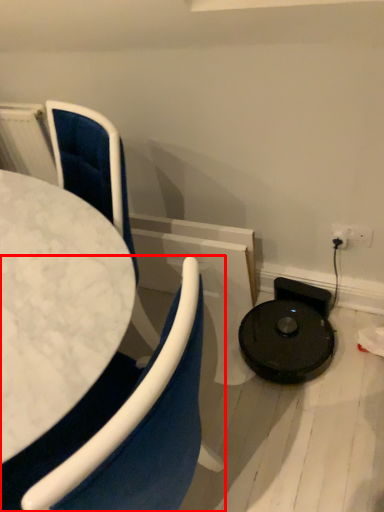
Question: From the image's perspective, where is chair (annotated by the red box) located relative to chair?

Choices:
 (A) below
 (B) above

Answer: (A)